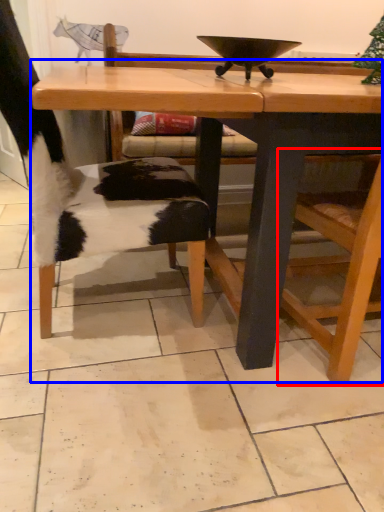
Question: Which object appears farthest to the camera in this image, armchair (highlighted by a red box) or table (highlighted by a blue box)?

Choices:
 (A) armchair
 (B) table

Answer: (B)